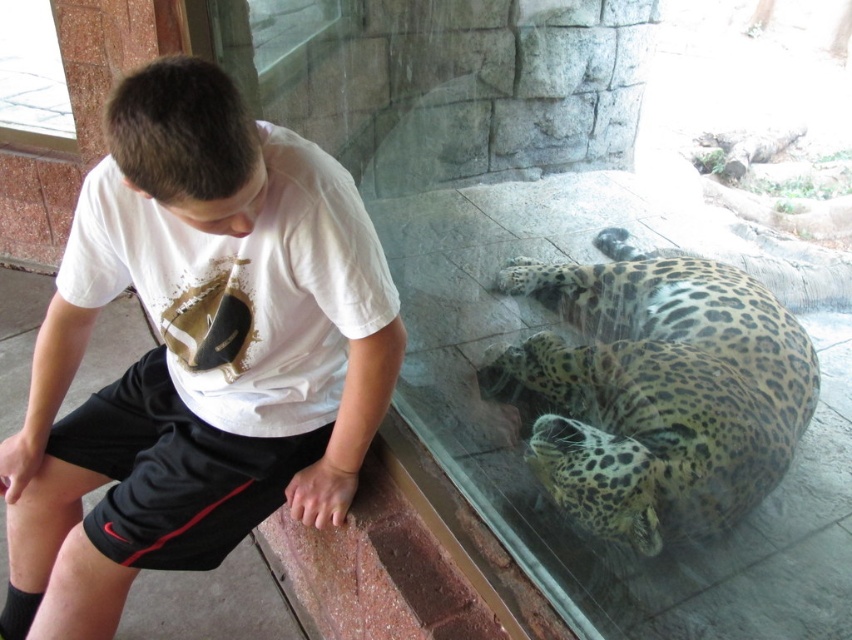
Question: From the image, what is the correct spatial relationship of white cotton shirt at center in relation to spotted fur leopard at lower right?

Choices:
 (A) below
 (B) above

Answer: (A)

Question: Among these objects, which one is nearest to the camera?

Choices:
 (A) white cotton shirt at center
 (B) spotted fur leopard at lower right

Answer: (A)

Question: Is white cotton shirt at center closer to camera compared to spotted fur leopard at lower right?

Choices:
 (A) no
 (B) yes

Answer: (B)

Question: Which object is farther from the camera taking this photo?

Choices:
 (A) spotted fur leopard at lower right
 (B) white cotton shirt at center

Answer: (A)

Question: Does white cotton shirt at center appear under spotted fur leopard at lower right?

Choices:
 (A) yes
 (B) no

Answer: (A)